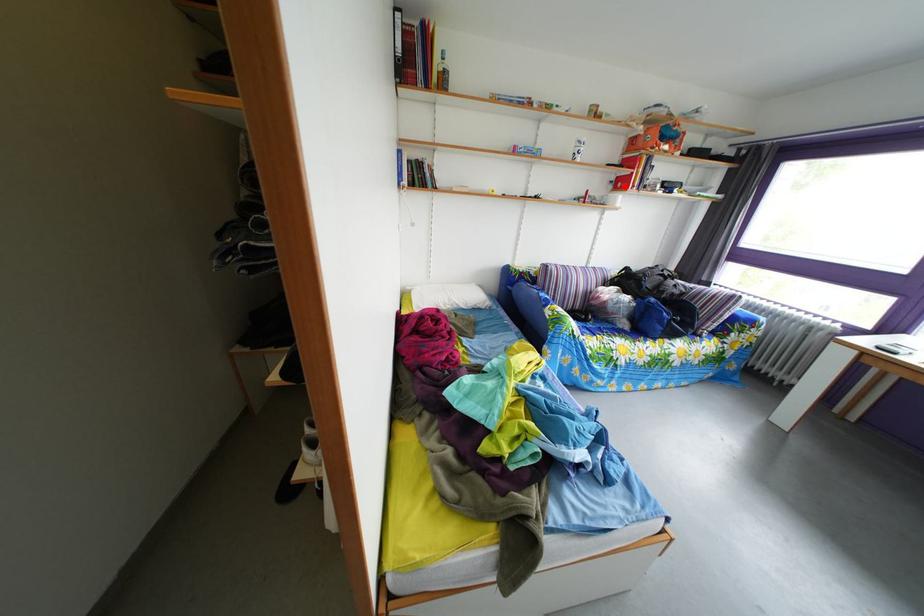
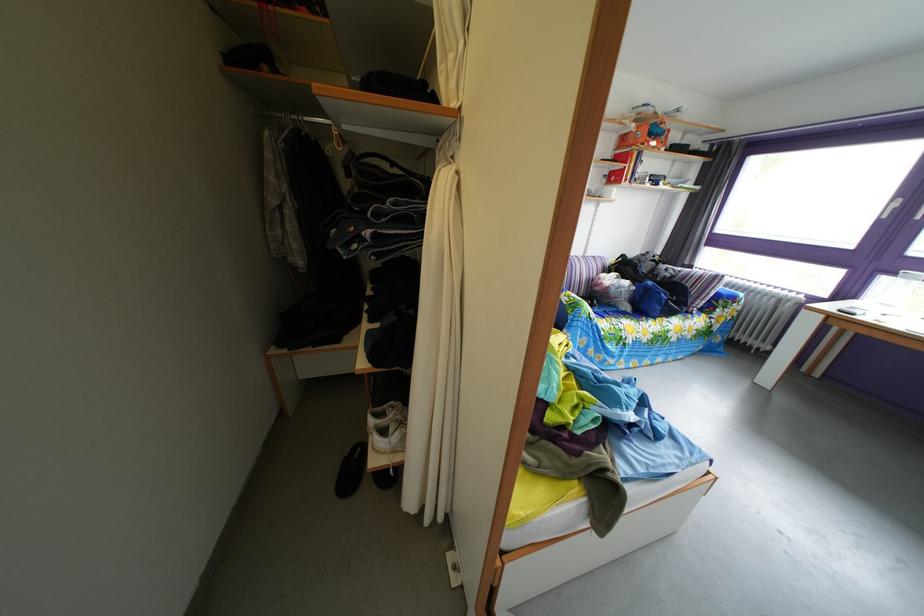
Question: I am providing you with two images of the same scene from different viewpoints. A red point is marked on the first image. Is the red point's position out of view in image 2?

Choices:
 (A) Yes
 (B) No

Answer: (B)